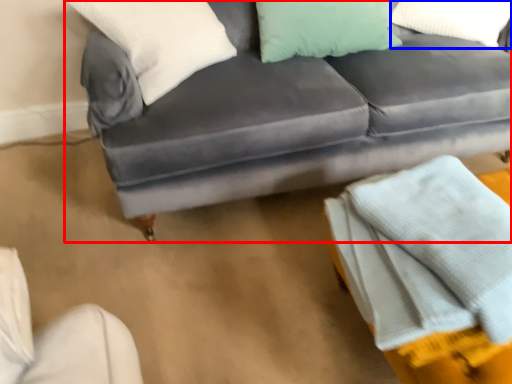
Question: Which point is further to the camera, studio couch (highlighted by a red box) or pillow (highlighted by a blue box)?

Choices:
 (A) studio couch
 (B) pillow

Answer: (B)